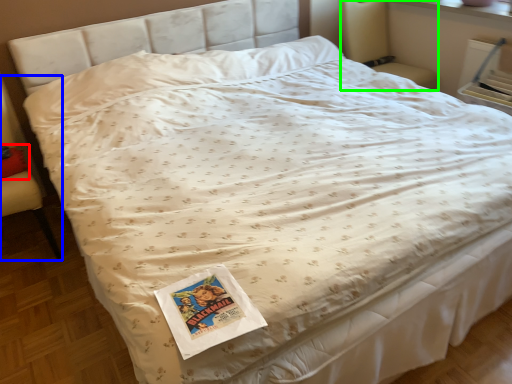
Question: Considering the real-world distances, which object is farthest from pillow (highlighted by a red box)? armchair (highlighted by a blue box) or armchair (highlighted by a green box)?

Choices:
 (A) armchair
 (B) armchair

Answer: (B)